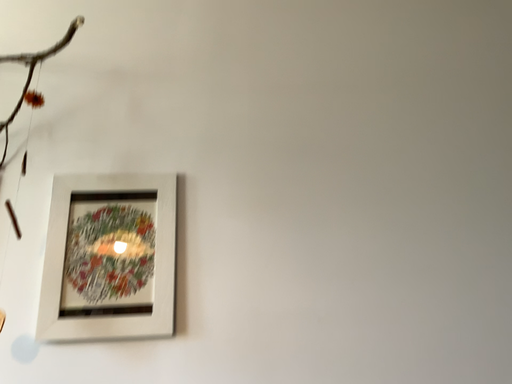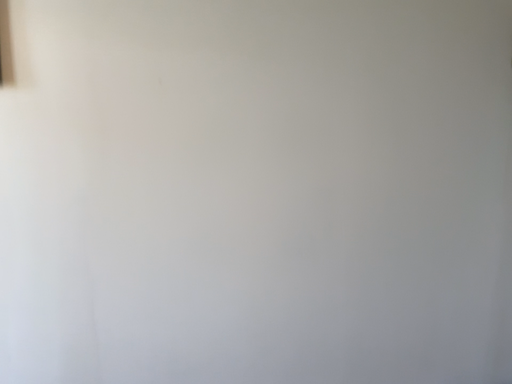
Question: How did the camera likely rotate when shooting the video?

Choices:
 (A) rotated upward
 (B) rotated downward

Answer: (B)